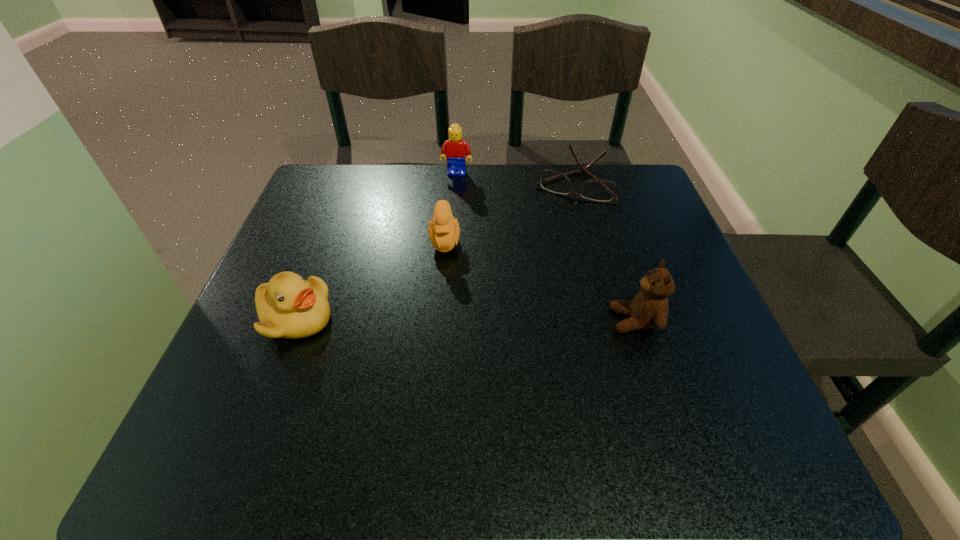
What are the coordinates of `vacant region at the far left corner` in the screenshot? It's located at (350, 172).

Identify the location of vacant space at the near right corner of the desktop. This screenshot has width=960, height=540. (730, 407).

The image size is (960, 540). I want to click on empty location between the teddy bear and the spectacles, so click(x=604, y=252).

Image resolution: width=960 pixels, height=540 pixels. I want to click on vacant area that lies between the nearer duckling and the spectacles, so click(434, 251).

Where is `free point between the Lego and the spectacles`? Image resolution: width=960 pixels, height=540 pixels. free point between the Lego and the spectacles is located at coordinates (515, 178).

Find the location of a particular element. blank region between the farther duckling and the leftmost object is located at coordinates [x=371, y=279].

Where is `blank region between the farther duckling and the Lego`? blank region between the farther duckling and the Lego is located at coordinates (451, 207).

Where is `empty space that is in between the right duckling and the Lego`? empty space that is in between the right duckling and the Lego is located at coordinates (x=451, y=207).

The width and height of the screenshot is (960, 540). I want to click on vacant area that lies between the Lego and the shortest object, so click(x=515, y=178).

You are a GUI agent. You are given a task and a screenshot of the screen. Output one action in this format:
    pyautogui.click(x=<x>, y=<y>)
    Task: Click on the vacant region between the teddy bear and the shortest object
    The image size is (960, 540).
    Given the screenshot: What is the action you would take?
    pyautogui.click(x=604, y=252)